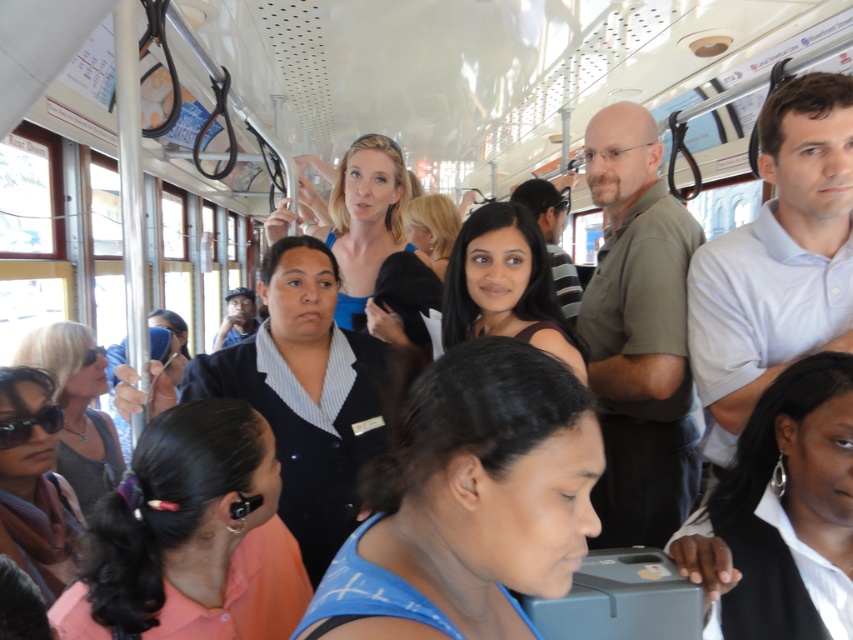
Question: Considering the relative positions of pink fabric earbud at lower left and green matte shirt at center in the image provided, where is pink fabric earbud at lower left located with respect to green matte shirt at center?

Choices:
 (A) below
 (B) above

Answer: (A)

Question: Is white glossy earpiece at center positioned at the back of dark brown hair at center?

Choices:
 (A) yes
 (B) no

Answer: (B)

Question: Does green matte shirt at center lie behind sunglasses at lower left?

Choices:
 (A) no
 (B) yes

Answer: (B)

Question: Which point is closer to the camera?

Choices:
 (A) white striped polo shirt at center
 (B) sunglasses at lower left
 (C) white glossy earpiece at center
 (D) green matte shirt at center

Answer: (C)

Question: Which object is farther from the camera taking this photo?

Choices:
 (A) white glossy earpiece at center
 (B) white striped polo shirt at center
 (C) pink fabric earbud at lower left

Answer: (B)

Question: Among these objects, which one is farthest from the camera?

Choices:
 (A) dark brown hair at center
 (B) white glossy earpiece at center
 (C) sunglasses at lower left

Answer: (A)